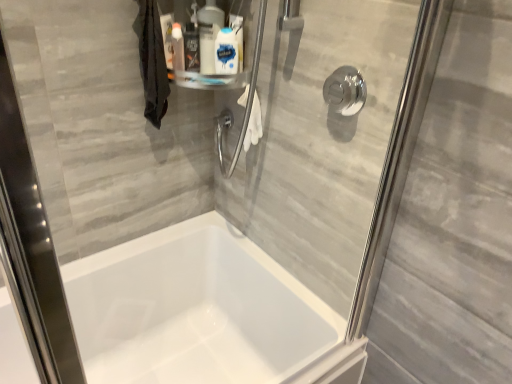
Question: Should I look upward or downward to see white glossy bottle at upper center, the 1th cleaning product from the right?

Choices:
 (A) up
 (B) down

Answer: (A)

Question: Is white glossy bottle at upper center, the 1th cleaning product from the right, oriented towards polished chrome shower handle at upper right?

Choices:
 (A) no
 (B) yes

Answer: (A)

Question: Is white glossy bottle at upper center, which is the 3th cleaning product in left-to-right order, at the left side of polished chrome shower handle at upper right?

Choices:
 (A) yes
 (B) no

Answer: (A)

Question: Can you confirm if white glossy bottle at upper center, which is the 3th cleaning product in left-to-right order, is shorter than polished chrome shower handle at upper right?

Choices:
 (A) no
 (B) yes

Answer: (A)

Question: Is white glossy bottle at upper center, which is the 3th cleaning product in left-to-right order, not near polished chrome shower handle at upper right?

Choices:
 (A) yes
 (B) no

Answer: (B)

Question: Is white glossy bottle at upper center, the 1th cleaning product from the right, positioned with its back to polished chrome shower handle at upper right?

Choices:
 (A) no
 (B) yes

Answer: (A)

Question: From the image's perspective, is white glossy bottle at upper center, which is the 3th cleaning product in left-to-right order, on top of polished chrome shower handle at upper right?

Choices:
 (A) yes
 (B) no

Answer: (A)

Question: Can you confirm if translucent plastic spray bottle at upper center, marked as the 1th cleaning product in a left-to-right arrangement, is bigger than white glossy bottle at upper center, the second cleaning product from the right?

Choices:
 (A) yes
 (B) no

Answer: (B)

Question: Can you confirm if translucent plastic spray bottle at upper center, which appears as the 3th cleaning product when viewed from the right, is shorter than white glossy bottle at upper center, the second cleaning product from the right?

Choices:
 (A) no
 (B) yes

Answer: (B)

Question: Would you say white glossy bottle at upper center, the second cleaning product from the right, is part of translucent plastic spray bottle at upper center, marked as the 1th cleaning product in a left-to-right arrangement,'s contents?

Choices:
 (A) yes
 (B) no

Answer: (B)

Question: Is translucent plastic spray bottle at upper center, marked as the 1th cleaning product in a left-to-right arrangement, completely or partially outside of white glossy bottle at upper center, the second cleaning product from the right?

Choices:
 (A) yes
 (B) no

Answer: (A)

Question: Does translucent plastic spray bottle at upper center, marked as the 1th cleaning product in a left-to-right arrangement, come in front of white glossy bottle at upper center, which ranks as the second cleaning product in left-to-right order?

Choices:
 (A) no
 (B) yes

Answer: (A)

Question: From a real-world perspective, is translucent plastic spray bottle at upper center, marked as the 1th cleaning product in a left-to-right arrangement, positioned over white glossy bottle at upper center, which ranks as the second cleaning product in left-to-right order, based on gravity?

Choices:
 (A) yes
 (B) no

Answer: (B)

Question: Does polished chrome shower handle at upper right have a greater height compared to white glossy bottle at upper center, the 1th cleaning product from the right?

Choices:
 (A) no
 (B) yes

Answer: (A)